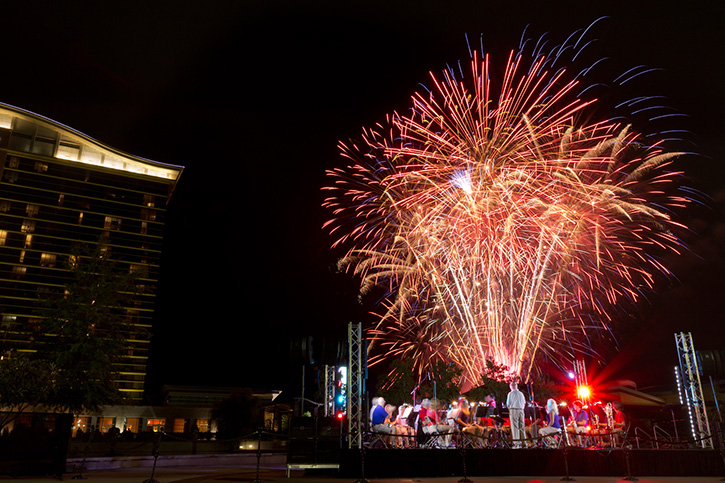
Identify the location of partition rope. (671, 441), (580, 435), (515, 439), (425, 434).